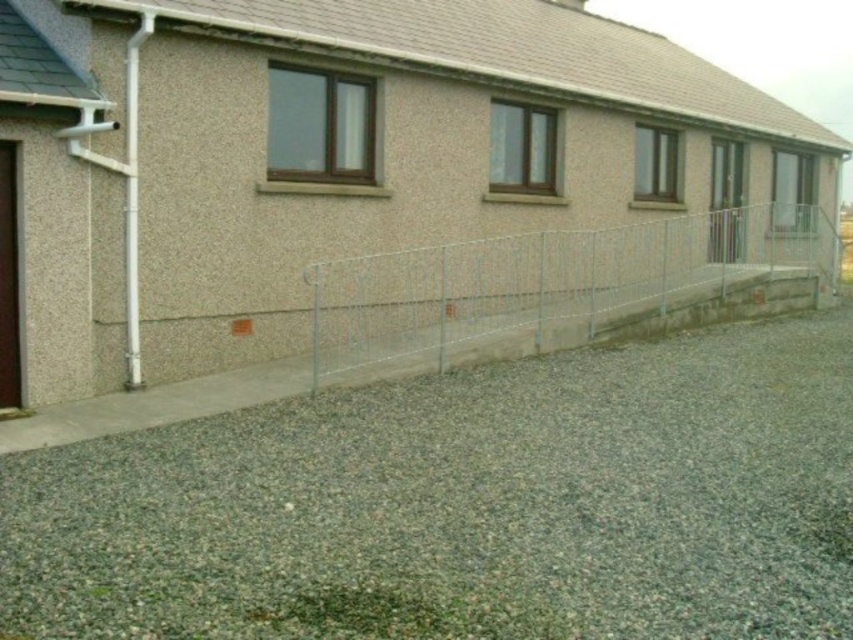
This screenshot has height=640, width=853. What do you see at coordinates (544, 285) in the screenshot?
I see `silver metallic fence at center` at bounding box center [544, 285].

I want to click on silver metallic fence at center, so click(x=544, y=285).

Is point (619, 346) positioned behind point (698, 248)?

No.

Who is positioned more to the right, gray gravel at lower center or silver metallic fence at center?

Positioned to the right is silver metallic fence at center.

Which is in front, point (476, 461) or point (447, 300)?

Point (476, 461) is in front.

Where is `gray gravel at lower center`? The image size is (853, 640). gray gravel at lower center is located at coordinates tap(467, 504).

Between gray gravel at lower center and brown wooden door at left, which one appears on the left side from the viewer's perspective?

From the viewer's perspective, brown wooden door at left appears more on the left side.

Which is below, gray gravel at lower center or brown wooden door at left?

gray gravel at lower center is lower down.

What do you see at coordinates (467, 504) in the screenshot?
I see `gray gravel at lower center` at bounding box center [467, 504].

Find the location of a particular element. The image size is (853, 640). gray gravel at lower center is located at coordinates (467, 504).